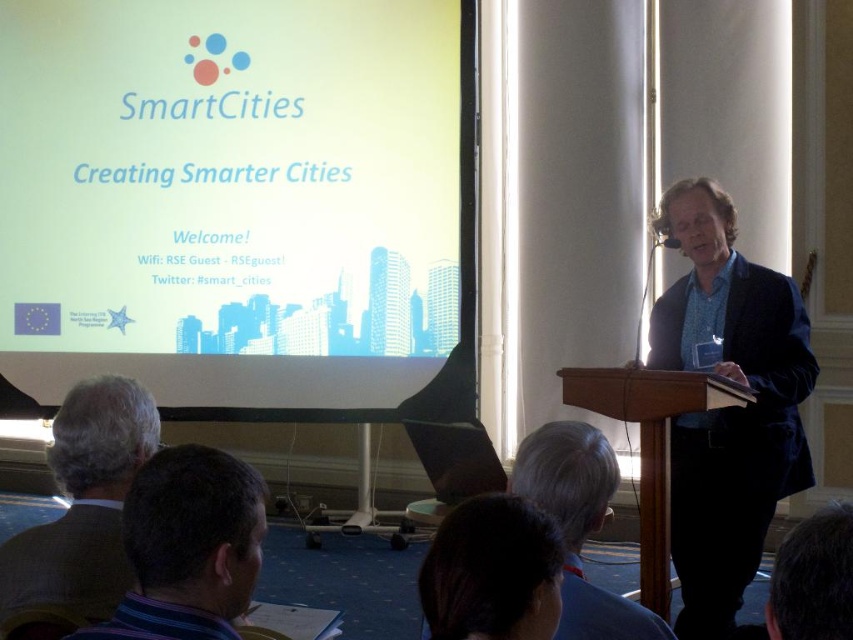
You are a photographer positioned at the camera. You want to capture a closeup shot of the blue fabric shirt at center. Considering the current distance, can you move closer to achieve this without exceeding the room dimensions?

The blue fabric shirt at center is 8.64 feet away from the camera. Since the room has a carpeted floor with a blue pattern and neutral beige walls, there is likely enough space to move closer to achieve the closeup shot.

You are a stagehand who needs to adjust the distance between the white matte projection screen at upper center and the dark blue striped shirt at lower left to exactly 3 meters for optimal viewing. How much should you move the screen or the shirt?

The current distance between the white matte projection screen at upper center and the dark blue striped shirt at lower left is 3.12 meters. To reduce it to 3 meters, you need to move either the screen or the shirt closer by 0.12 meters.